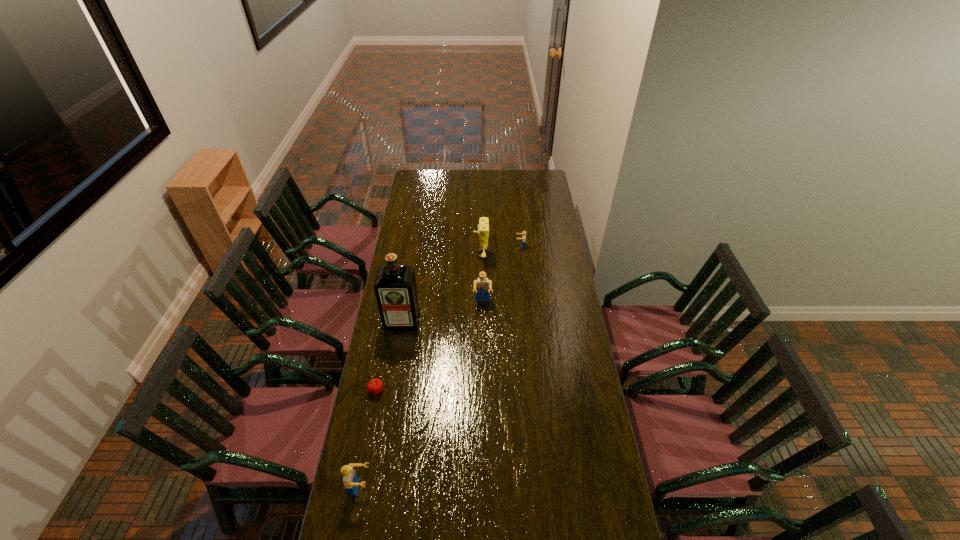
To ensure equal spacing by inserting another Lego among them, please point out a vacant spot for this new Lego. Please provide its 2D coordinates. Your answer should be formatted as a tuple, i.e. [(x, y)], where the tuple contains the x and y coordinates of a point satisfying the conditions above.

[(432, 380)]